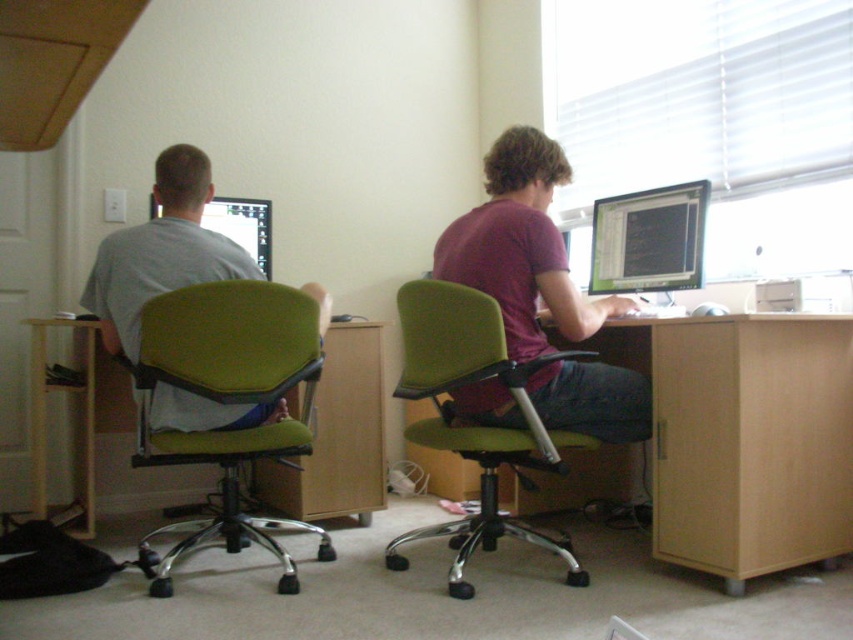
Who is higher up, light brown wood computer desk at lower right or wooden table at lower left?

light brown wood computer desk at lower right is higher up.

Does light brown wood computer desk at lower right have a lesser width compared to wooden table at lower left?

Yes, light brown wood computer desk at lower right is thinner than wooden table at lower left.

I want to click on light brown wood computer desk at lower right, so 746,436.

You are a GUI agent. You are given a task and a screenshot of the screen. Output one action in this format:
    pyautogui.click(x=<x>, y=<y>)
    Task: Click on the light brown wood computer desk at lower right
    
    Given the screenshot: What is the action you would take?
    pyautogui.click(x=746, y=436)

Between green fabric office chair at left and matte gray shirt at left, which one is positioned lower?

green fabric office chair at left is below.

Between point (262, 396) and point (213, 273), which one is positioned behind?

The point (213, 273) is more distant.

Describe the element at coordinates (229, 400) in the screenshot. I see `green fabric office chair at left` at that location.

This screenshot has width=853, height=640. Identify the location of green fabric office chair at left. (229, 400).

Which of these two, green fabric office chair at left or green fabric office chair at center, stands taller?

green fabric office chair at center is taller.

Can you confirm if green fabric office chair at left is positioned above green fabric office chair at center?

Yes.

Locate an element on the screen. Image resolution: width=853 pixels, height=640 pixels. green fabric office chair at left is located at coordinates click(229, 400).

The height and width of the screenshot is (640, 853). What are the coordinates of `green fabric office chair at left` in the screenshot? It's located at (229, 400).